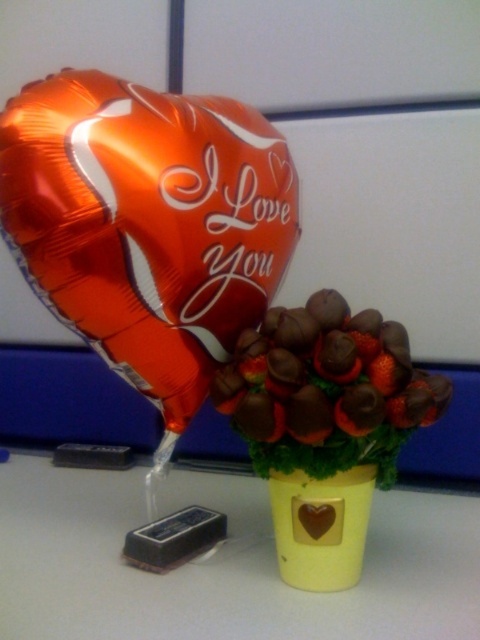
Can you confirm if shiny metallic heart at upper left is thinner than dark brown matte chocolate bar at lower left?

No, shiny metallic heart at upper left is not thinner than dark brown matte chocolate bar at lower left.

Who is more forward, [274,285] or [194,545]?

Positioned in front is point [194,545].

The width and height of the screenshot is (480, 640). In order to click on shiny metallic heart at upper left in this screenshot , I will do `click(146, 224)`.

Which is in front, point (224, 369) or point (131, 532)?

Point (224, 369)

Consider the image. Can you confirm if chocolate-covered strawberries at center is thinner than dark brown matte chocolate bar at lower left?

In fact, chocolate-covered strawberries at center might be wider than dark brown matte chocolate bar at lower left.

Where is `chocolate-covered strawberries at center`? This screenshot has width=480, height=640. chocolate-covered strawberries at center is located at coordinates coord(325,376).

Between shiny metallic heart at upper left and brushed metal chocolate bar at lower left, which one appears on the right side from the viewer's perspective?

From the viewer's perspective, shiny metallic heart at upper left appears more on the right side.

Who is shorter, shiny metallic heart at upper left or brushed metal chocolate bar at lower left?

With less height is brushed metal chocolate bar at lower left.

Where is `shiny metallic heart at upper left`? The width and height of the screenshot is (480, 640). shiny metallic heart at upper left is located at coordinates (146, 224).